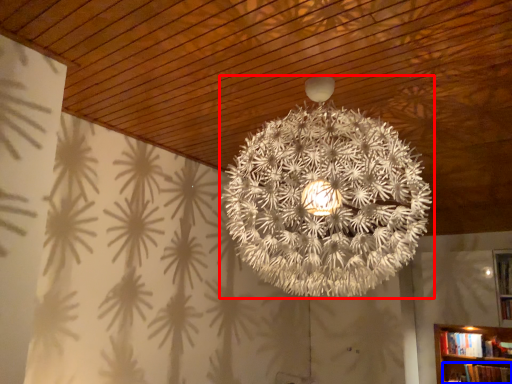
Question: Which point is closer to the camera, lamp (highlighted by a red box) or book (highlighted by a blue box)?

Choices:
 (A) lamp
 (B) book

Answer: (A)